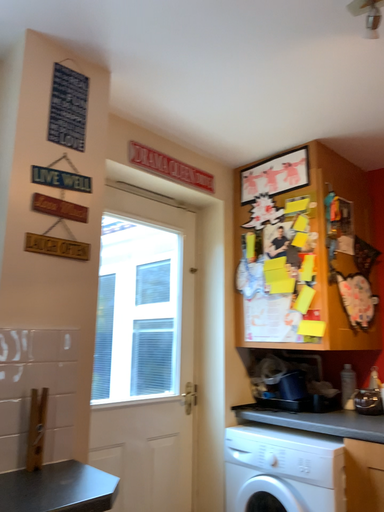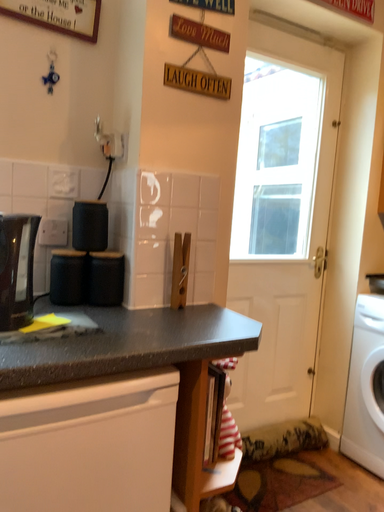
Question: Which way did the camera rotate in the video?

Choices:
 (A) rotated upward
 (B) rotated downward

Answer: (B)